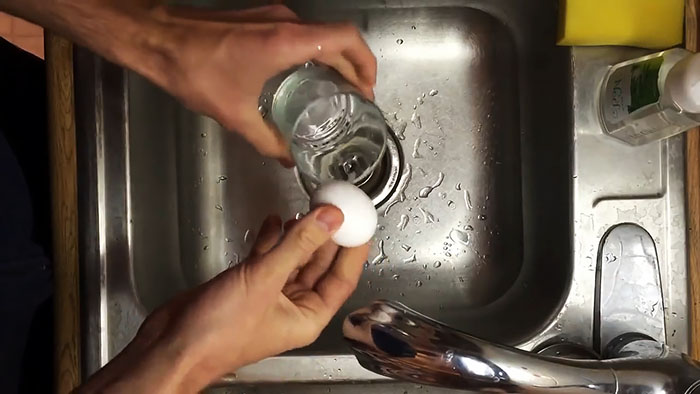
The image size is (700, 394). Identify the location of sponge. (620, 27).